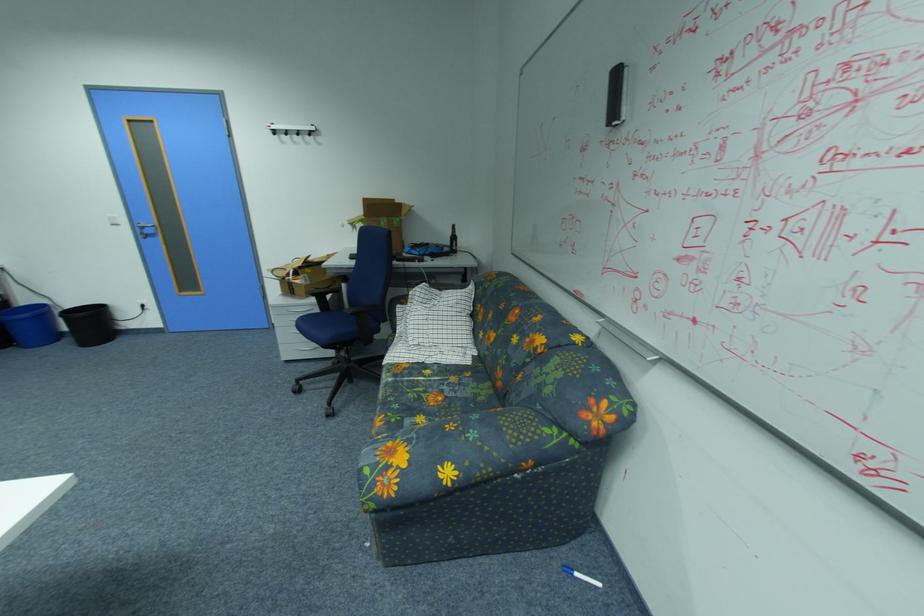
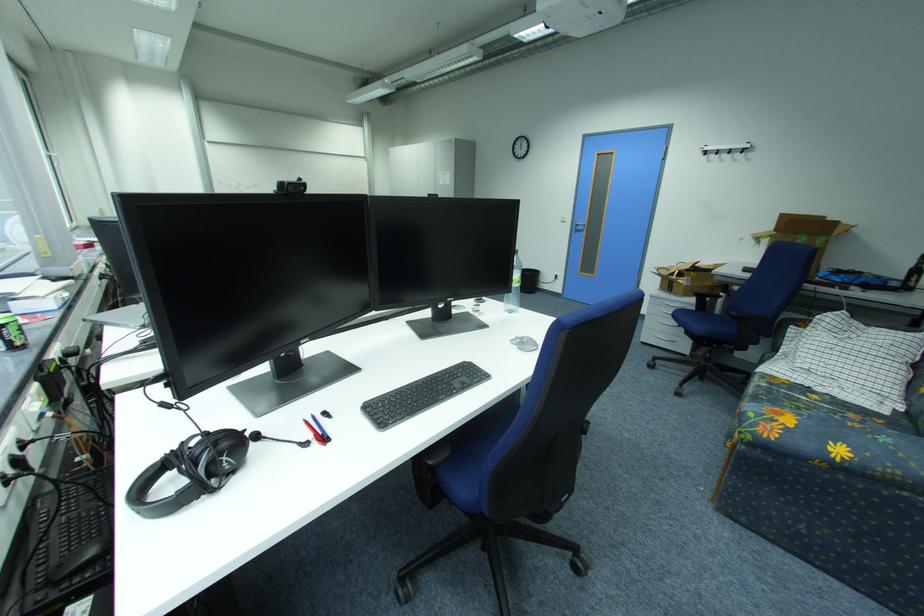
The point at (x=337, y=278) is marked in the first image. Where is the corresponding point in the second image?

(718, 286)